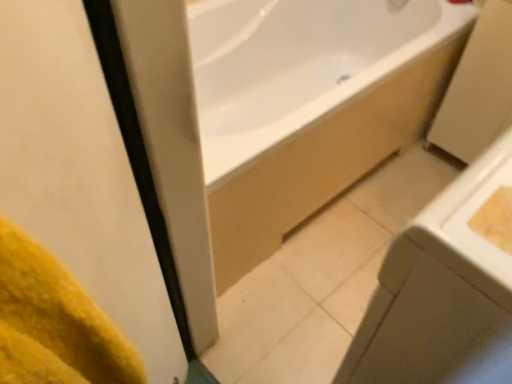
Question: From the image's perspective, is yellow fabric at left located above or below white glossy sink at lower right?

Choices:
 (A) below
 (B) above

Answer: (A)

Question: Visually, is yellow fabric at left positioned to the left or to the right of white glossy sink at lower right?

Choices:
 (A) right
 (B) left

Answer: (B)

Question: Which object is positioned farthest from the yellow fabric at left?

Choices:
 (A) white glossy sink at lower right
 (B) white glossy bathtub at upper center

Answer: (B)

Question: Which of these objects is positioned farthest from the yellow fabric at left?

Choices:
 (A) white glossy bathtub at upper center
 (B) white glossy sink at lower right

Answer: (A)